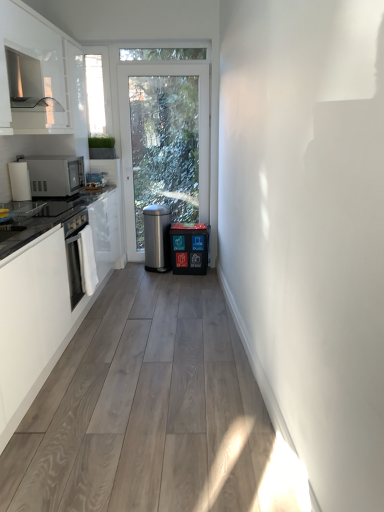
Question: Should I look upward or downward to see metallic silver dishwasher at center?

Choices:
 (A) down
 (B) up

Answer: (B)

Question: Considering the relative sizes of satin silver microwave at left and metallic silver dishwasher at center in the image provided, is satin silver microwave at left wider than metallic silver dishwasher at center?

Choices:
 (A) yes
 (B) no

Answer: (A)

Question: From the image's perspective, is satin silver microwave at left above metallic silver dishwasher at center?

Choices:
 (A) no
 (B) yes

Answer: (B)

Question: Considering the relative positions of satin silver microwave at left and metallic silver dishwasher at center in the image provided, is satin silver microwave at left to the right of metallic silver dishwasher at center from the viewer's perspective?

Choices:
 (A) yes
 (B) no

Answer: (B)

Question: Is satin silver microwave at left aimed at metallic silver dishwasher at center?

Choices:
 (A) yes
 (B) no

Answer: (B)

Question: Is satin silver microwave at left completely or partially outside of metallic silver dishwasher at center?

Choices:
 (A) yes
 (B) no

Answer: (A)

Question: Considering the relative sizes of satin silver microwave at left and metallic silver dishwasher at center in the image provided, is satin silver microwave at left smaller than metallic silver dishwasher at center?

Choices:
 (A) no
 (B) yes

Answer: (B)

Question: From a real-world perspective, is polished stainless steel trash can at center beneath satin silver microwave at left?

Choices:
 (A) no
 (B) yes

Answer: (B)

Question: From a real-world perspective, is polished stainless steel trash can at center located higher than satin silver microwave at left?

Choices:
 (A) no
 (B) yes

Answer: (A)

Question: Is polished stainless steel trash can at center looking in the opposite direction of satin silver microwave at left?

Choices:
 (A) no
 (B) yes

Answer: (A)

Question: From the image's perspective, does polished stainless steel trash can at center appear lower than satin silver microwave at left?

Choices:
 (A) no
 (B) yes

Answer: (B)

Question: Does polished stainless steel trash can at center appear on the left side of satin silver microwave at left?

Choices:
 (A) yes
 (B) no

Answer: (B)

Question: Is polished stainless steel trash can at center not near satin silver microwave at left?

Choices:
 (A) no
 (B) yes

Answer: (B)

Question: Considering the relative sizes of satin silver microwave at left and transparent glass window at upper left in the image provided, is satin silver microwave at left taller than transparent glass window at upper left?

Choices:
 (A) no
 (B) yes

Answer: (A)